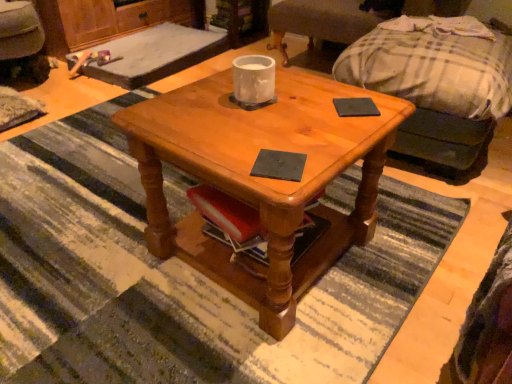
Question: In terms of width, does black matte coaster at center, the second pad positioned from the right, look wider or thinner when compared to velvet dark brown swivel chair at lower left, acting as the first swivel chair starting from the left?

Choices:
 (A) thin
 (B) wide

Answer: (A)

Question: Does point (289, 180) appear closer or farther from the camera than point (15, 6)?

Choices:
 (A) closer
 (B) farther

Answer: (A)

Question: Estimate the real-world distances between objects in this image. Which object is closer to the plaid fabric swivel chair at upper right, placed as the 2th swivel chair when sorted from left to right?

Choices:
 (A) black matte pad at center, acting as the second pad starting from the bottom
 (B) velvet dark brown swivel chair at lower left, acting as the first swivel chair starting from the left
 (C) plaid fabric couch at upper right
 (D) matte wood coffee table at center
 (E) black matte coaster at center, the 1th pad from the bottom

Answer: (C)

Question: Considering the real-world distances, which object is closest to the plaid fabric swivel chair at upper right, placed as the 2th swivel chair when sorted from left to right?

Choices:
 (A) matte wood coffee table at center
 (B) black matte coaster at center, the first pad viewed from the front
 (C) black matte pad at center, the 2th pad positioned from the left
 (D) velvet dark brown swivel chair at lower left, acting as the first swivel chair starting from the left
 (E) plaid fabric couch at upper right

Answer: (E)